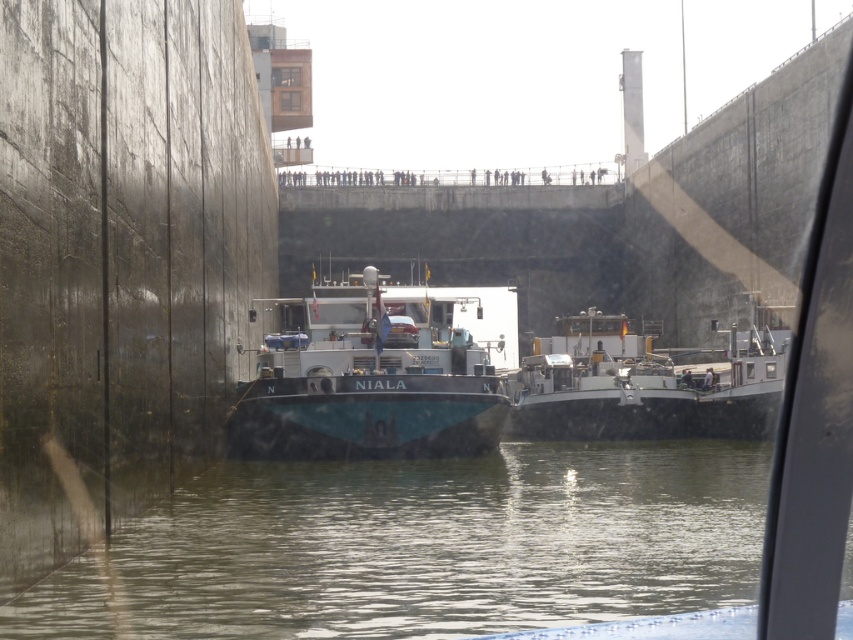
You are a boat operator who needs to navigate through a narrow waterway. You see the teal matte boat at center and the white glossy barge at center ahead. Which boat should you avoid overtaking to ensure safe passage?

You should avoid overtaking the teal matte boat at center because it is bigger than the white glossy barge at center, making it harder to maneuver in the narrow waterway.

You are a tour guide explaining the boats in the image to visitors. You want to highlight the position of the teal matte boat at center and the white glossy barge at center. Which boat should you point out first to emphasize its proximity to the viewers?

The teal matte boat at center is closer to the viewer than the white glossy barge at center, so you should point out the teal matte boat at center first to emphasize its proximity.

You are standing on the raised walkway in the background of the image. You want to take a photo of the clear water at center. Where should you point your camera to capture it?

You should point your camera towards the center of the image at point coordinates approximately (424, 547) to capture the clear water at center.